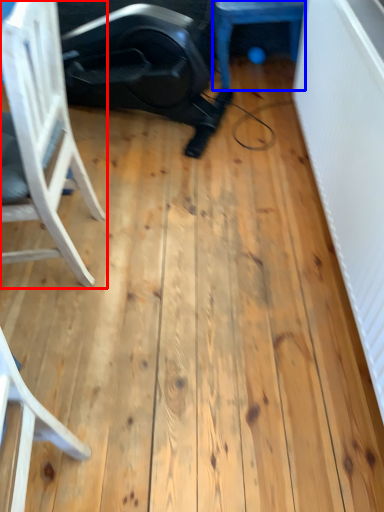
Question: Which of the following is the farthest to the observer, chair (highlighted by a red box) or furniture (highlighted by a blue box)?

Choices:
 (A) chair
 (B) furniture

Answer: (B)